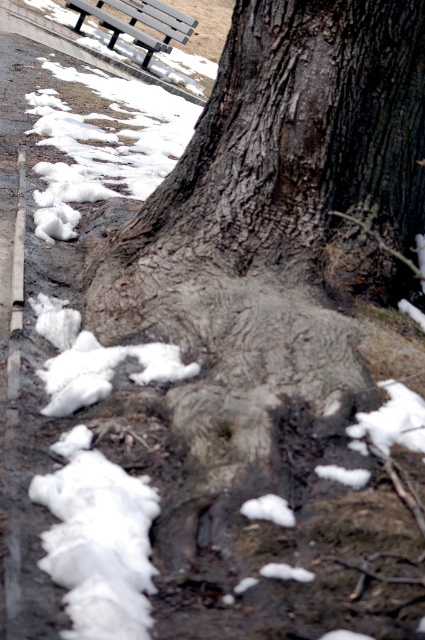
Question: Which of the following is the farthest from the observer?

Choices:
 (A) metallic gray bench at upper left
 (B) gray rough bark tree at center
 (C) white fluffy snow at lower left

Answer: (A)

Question: From the image, what is the correct spatial relationship of gray rough bark tree at center in relation to metallic gray bench at upper left?

Choices:
 (A) above
 (B) below

Answer: (B)

Question: Estimate the real-world distances between objects in this image. Which object is closer to the gray rough bark tree at center?

Choices:
 (A) metallic gray bench at upper left
 (B) white fluffy snow at lower left

Answer: (B)

Question: Which object is the farthest from the gray rough bark tree at center?

Choices:
 (A) metallic gray bench at upper left
 (B) white fluffy snow at lower left

Answer: (A)

Question: Is gray rough bark tree at center in front of white fluffy snow at lower left?

Choices:
 (A) yes
 (B) no

Answer: (B)

Question: Is gray rough bark tree at center smaller than metallic gray bench at upper left?

Choices:
 (A) no
 (B) yes

Answer: (B)